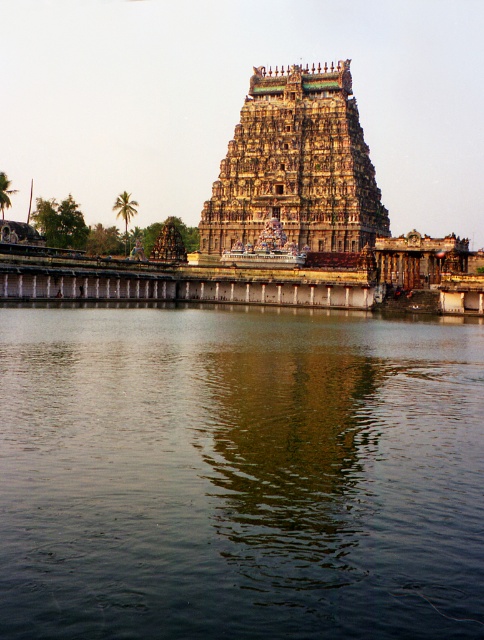
You are a tourist visiting the temple complex and want to take a photo that captures both the green reflective water at center and the carved stone temple at center. Considering their sizes, which object will occupy more space in your photo?

The green reflective water at center has a larger size compared to the carved stone temple at center, so it will occupy more space in the photo.

You are a visitor standing at the entrance of the temple complex and want to take a photo of the carved stone temple at center. However, there is green reflective water at center in the way. Can you move to the right to avoid the water and still capture the temple in your photo?

The green reflective water at center is positioned on the left side of the carved stone temple at center. Moving to the right would allow you to avoid the water and still capture the temple in your photo since the temple is to the right of the water.

You are a visitor standing at the entrance of the temple complex. You want to cross to the other side of the green reflective water at center without getting your feet wet. The carved stone temple at center is in your way. Can you walk around the temple to reach the other side of the water?

The green reflective water at center is wider than the carved stone temple at center. Therefore, you can walk around the temple to reach the other side of the water.